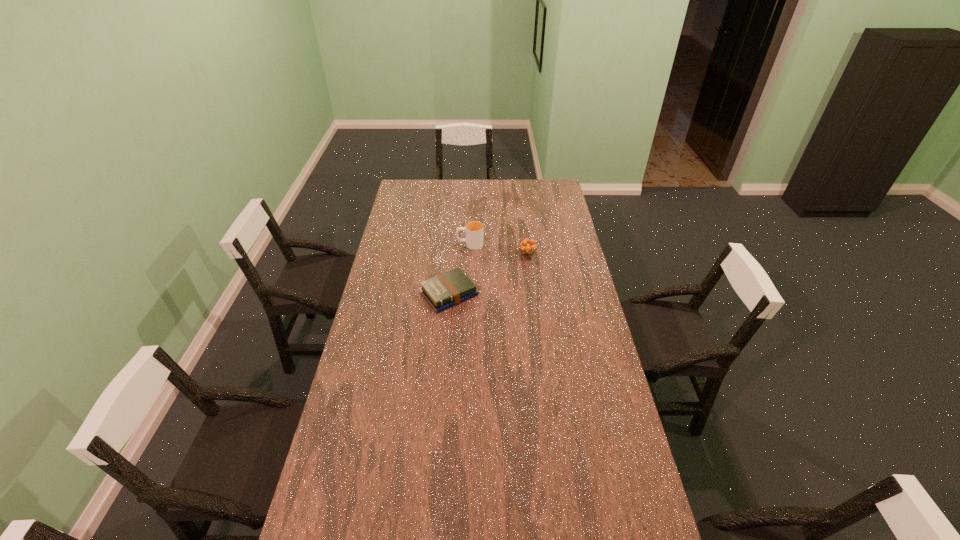
This screenshot has height=540, width=960. What are the coordinates of `cup` in the screenshot? It's located at (474, 230).

At what (x,y) coordinates should I click in order to perform the action: click on the second shortest object. Please return your answer as a coordinate pair (x, y). Looking at the image, I should click on (527, 246).

Where is `the rightmost object`? The image size is (960, 540). the rightmost object is located at coordinates (527, 246).

This screenshot has height=540, width=960. Identify the location of the shortest object. pyautogui.click(x=443, y=291).

Where is `book`? The height and width of the screenshot is (540, 960). book is located at coordinates (443, 291).

You are a GUI agent. You are given a task and a screenshot of the screen. Output one action in this format:
    pyautogui.click(x=<x>, y=<y>)
    Task: Click on the free space located with the handle on the side of the tallest object
    This screenshot has height=540, width=960.
    Given the screenshot: What is the action you would take?
    pyautogui.click(x=427, y=245)

Locate an element on the screen. Image resolution: width=960 pixels, height=540 pixels. vacant space situated 0.070m with the handle on the side of the tallest object is located at coordinates (443, 245).

In order to click on vacant space located with the handle on the side of the tallest object in this screenshot , I will do `click(425, 245)`.

The height and width of the screenshot is (540, 960). I want to click on vacant space located 0.360m on the front of the orange fruit, so [x=536, y=315].

Locate an element on the screen. The width and height of the screenshot is (960, 540). vacant space located on the left of the nearest object is located at coordinates (393, 294).